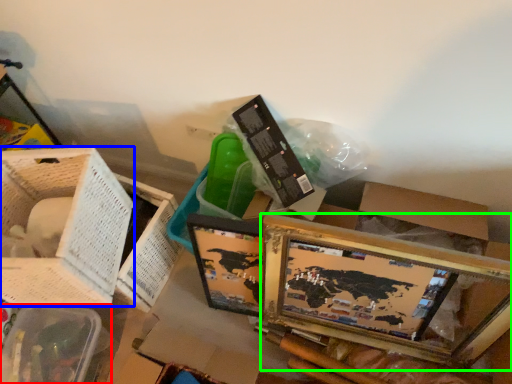
Question: Estimate the real-world distances between objects in this image. Which object is closer to basket (highlighted by a red box), basket (highlighted by a blue box) or picture frame (highlighted by a green box)?

Choices:
 (A) basket
 (B) picture frame

Answer: (A)